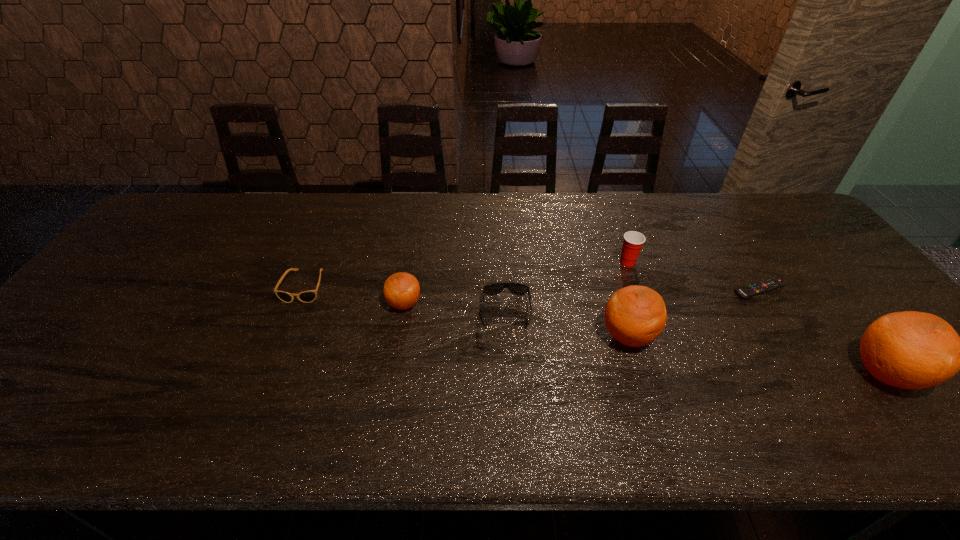
Where is `vacant space located 0.100m on the back of the sixth object from right to left`? The width and height of the screenshot is (960, 540). vacant space located 0.100m on the back of the sixth object from right to left is located at coordinates point(411,268).

I want to click on free space located on the left of the second tallest orange, so click(507, 336).

Locate an element on the screen. vacant area situated on the back of the rightmost object is located at coordinates (808, 275).

You are a GUI agent. You are given a task and a screenshot of the screen. Output one action in this format:
    pyautogui.click(x=<x>, y=<y>)
    Task: Click on the vacant region located on the right of the Dixie cup
    This screenshot has width=960, height=540.
    Given the screenshot: What is the action you would take?
    pyautogui.click(x=675, y=262)

Find the location of a particular element. The image size is (960, 540). vacant area situated 0.130m on the front-facing side of the fifth object from right to left is located at coordinates (511, 375).

Identify the location of vacant position located on the left of the remote control. (669, 289).

What are the coordinates of `vacant area located on the front-facing side of the left sunglasses` in the screenshot? It's located at (282, 339).

Find the location of `object at the near edge`. object at the near edge is located at coordinates (911, 350).

Where is `object situated at the right edge`? object situated at the right edge is located at coordinates (911, 350).

At what (x,y) coordinates should I click in order to perform the action: click on object located in the near right corner section of the desktop. Please return your answer as a coordinate pair (x, y). Looking at the image, I should click on (911, 350).